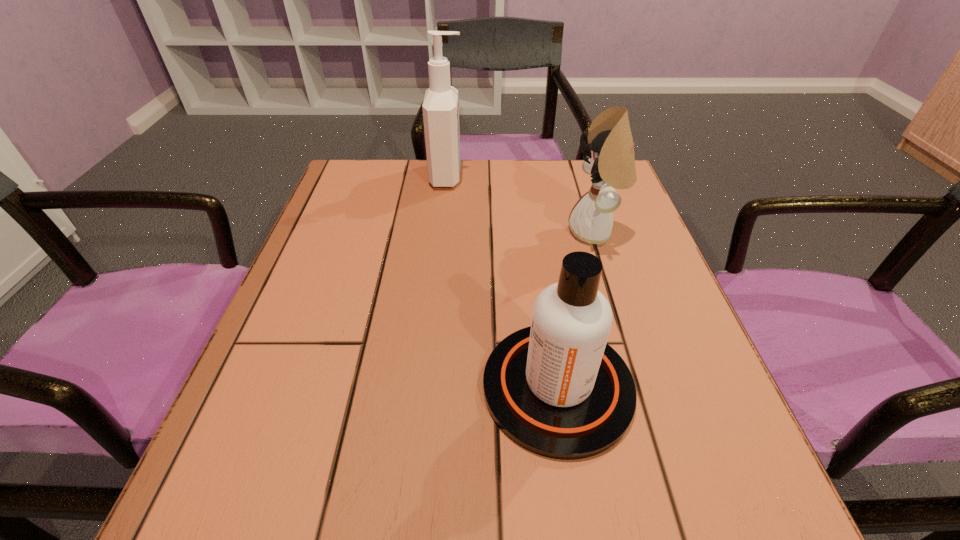
The height and width of the screenshot is (540, 960). I want to click on the left cleansing agent, so click(440, 107).

The width and height of the screenshot is (960, 540). I want to click on the taller cleansing agent, so click(x=440, y=107).

Locate an element on the screen. doll is located at coordinates (610, 161).

Locate an element on the screen. This screenshot has width=960, height=540. the right cleansing agent is located at coordinates (557, 389).

You are a GUI agent. You are given a task and a screenshot of the screen. Output one action in this format:
    pyautogui.click(x=<x>, y=<y>)
    Task: Click on the shorter cleansing agent
    
    Given the screenshot: What is the action you would take?
    pyautogui.click(x=557, y=389)

The width and height of the screenshot is (960, 540). Identify the location of vacant area situated 0.340m on the front label of the leftmost object. (593, 176).

What are the coordinates of `free space located at the front face of the doll` in the screenshot? It's located at (411, 232).

I want to click on free space located at the front face of the doll, so click(x=461, y=232).

Locate an element on the screen. The image size is (960, 540). vacant region located at the front face of the doll is located at coordinates (483, 232).

You are a GUI agent. You are given a task and a screenshot of the screen. Output one action in this format:
    pyautogui.click(x=<x>, y=<y>)
    Task: Click on the free space located on the back of the right cleansing agent
    The height and width of the screenshot is (540, 960).
    Given the screenshot: What is the action you would take?
    pyautogui.click(x=542, y=282)